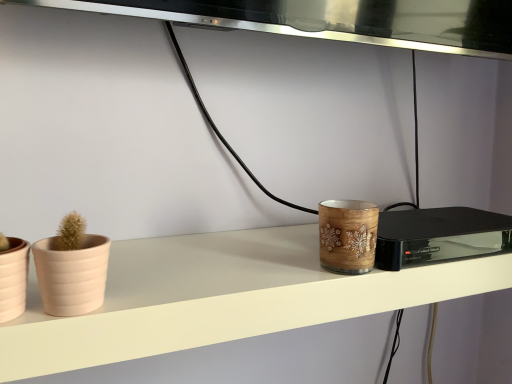
Question: Considering the relative sizes of beige matte flowerpot at left, positioned as the 2th flowerpot in left-to-right order, and wooden candle holder at center in the image provided, is beige matte flowerpot at left, positioned as the 2th flowerpot in left-to-right order, wider than wooden candle holder at center?

Choices:
 (A) yes
 (B) no

Answer: (B)

Question: Can you confirm if beige matte flowerpot at left, the first flowerpot from the right, is smaller than wooden candle holder at center?

Choices:
 (A) yes
 (B) no

Answer: (A)

Question: Is beige matte flowerpot at left, positioned as the 2th flowerpot in left-to-right order, thinner than wooden candle holder at center?

Choices:
 (A) no
 (B) yes

Answer: (B)

Question: Does beige matte flowerpot at left, positioned as the 2th flowerpot in left-to-right order, lie behind wooden candle holder at center?

Choices:
 (A) yes
 (B) no

Answer: (B)

Question: Is beige matte flowerpot at left, the first flowerpot from the right, to the left of wooden candle holder at center from the viewer's perspective?

Choices:
 (A) no
 (B) yes

Answer: (B)

Question: Considering the relative positions of beige matte flowerpot at left, the first flowerpot from the right, and wooden candle holder at center in the image provided, is beige matte flowerpot at left, the first flowerpot from the right, in front of wooden candle holder at center?

Choices:
 (A) no
 (B) yes

Answer: (B)

Question: Is matte pink flowerpot at left, which is counted as the 1th flowerpot, starting from the left, inside wooden candle holder at center?

Choices:
 (A) no
 (B) yes

Answer: (A)

Question: Is wooden candle holder at center at the left side of matte pink flowerpot at left, which is the second flowerpot in right-to-left order?

Choices:
 (A) yes
 (B) no

Answer: (B)

Question: Considering the relative sizes of wooden candle holder at center and matte pink flowerpot at left, which is the second flowerpot in right-to-left order, in the image provided, is wooden candle holder at center shorter than matte pink flowerpot at left, which is the second flowerpot in right-to-left order,?

Choices:
 (A) no
 (B) yes

Answer: (A)

Question: Does wooden candle holder at center appear on the right side of matte pink flowerpot at left, which is the second flowerpot in right-to-left order?

Choices:
 (A) no
 (B) yes

Answer: (B)

Question: Considering the relative positions of wooden candle holder at center and matte pink flowerpot at left, which is the second flowerpot in right-to-left order, in the image provided, is wooden candle holder at center behind matte pink flowerpot at left, which is the second flowerpot in right-to-left order,?

Choices:
 (A) no
 (B) yes

Answer: (B)

Question: Can you confirm if wooden candle holder at center is thinner than matte pink flowerpot at left, which is the second flowerpot in right-to-left order?

Choices:
 (A) yes
 (B) no

Answer: (A)

Question: Is the position of matte pink flowerpot at left, which is counted as the 1th flowerpot, starting from the left, less distant than that of beige matte flowerpot at left, positioned as the 2th flowerpot in left-to-right order?

Choices:
 (A) no
 (B) yes

Answer: (B)